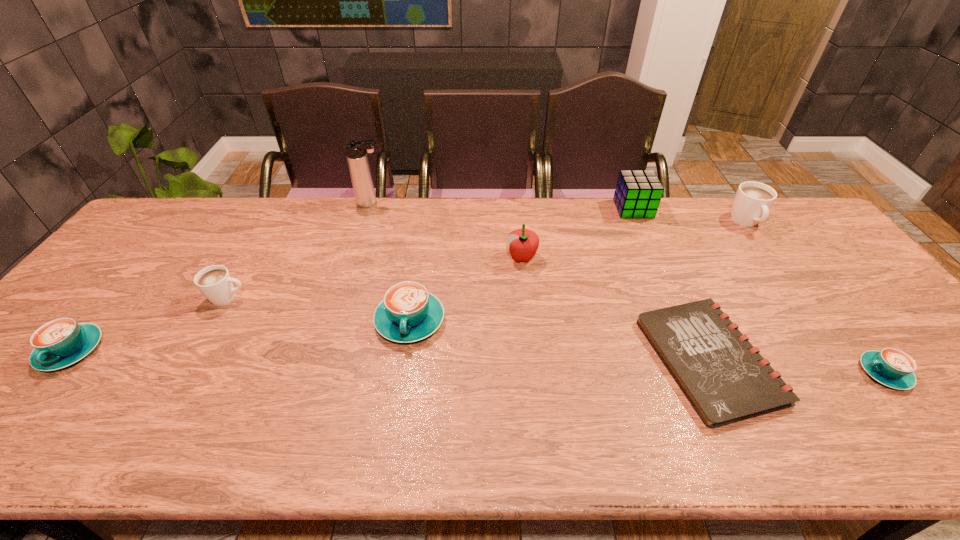
Where is `thermos bottle`? The image size is (960, 540). thermos bottle is located at coordinates click(356, 151).

The width and height of the screenshot is (960, 540). In order to click on the tallest object in this screenshot , I will do `click(356, 151)`.

Find the location of a particular element. Image resolution: width=960 pixels, height=540 pixels. cube is located at coordinates (638, 193).

Locate an element on the screen. This screenshot has width=960, height=540. red apple is located at coordinates (523, 243).

Identify the location of apple. (523, 243).

This screenshot has height=540, width=960. I want to click on the farthest cappuccino, so [751, 205].

Find the location of a particular element. the farther white cappuccino is located at coordinates click(751, 205).

Where is `the biggest turquoise cappuccino`? The height and width of the screenshot is (540, 960). the biggest turquoise cappuccino is located at coordinates (408, 313).

Identify the location of the fourth object from left to right. This screenshot has width=960, height=540. (408, 313).

Image resolution: width=960 pixels, height=540 pixels. I want to click on the smaller white cappuccino, so click(x=215, y=282).